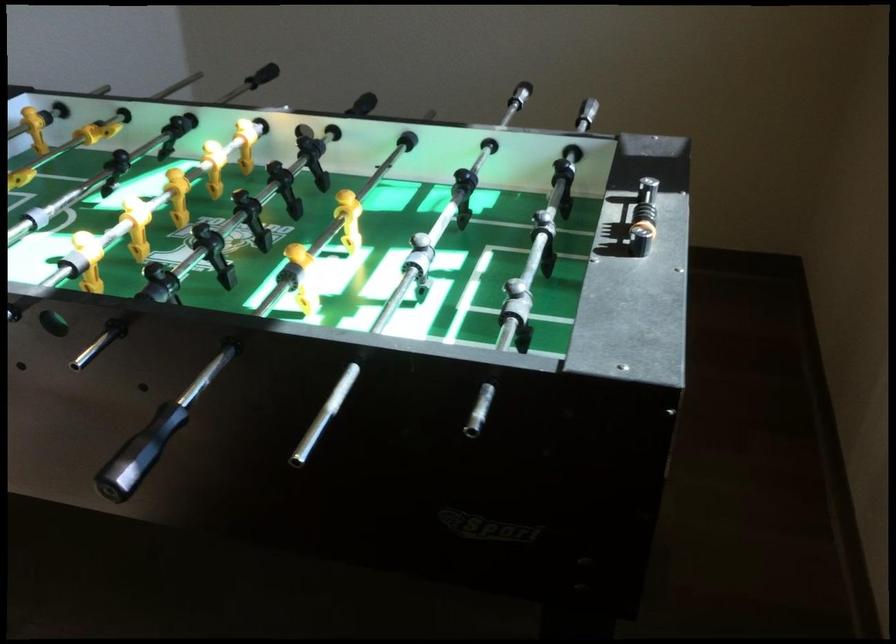
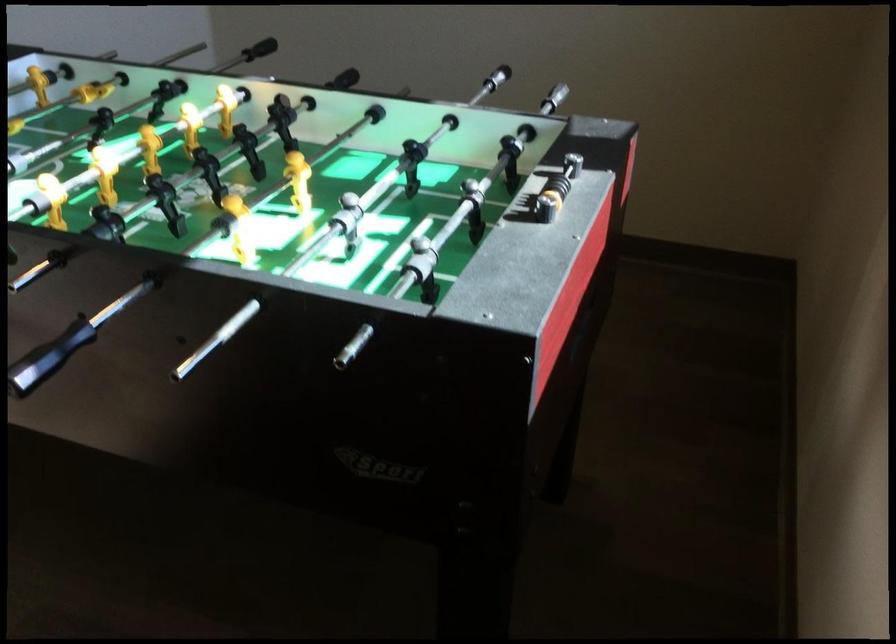
Locate, in the second image, the point that corresponds to (244,73) in the first image.

(259, 49)